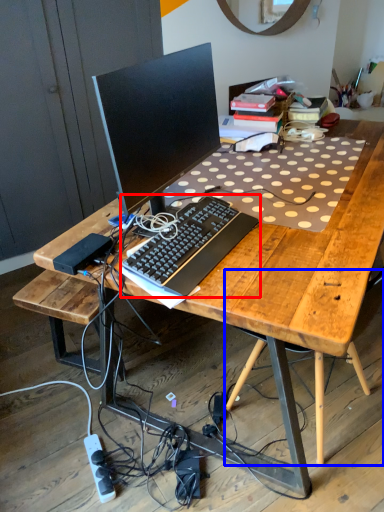
Question: Among these objects, which one is nearest to the camera, computer keyboard (highlighted by a red box) or computer chair (highlighted by a blue box)?

Choices:
 (A) computer keyboard
 (B) computer chair

Answer: (B)